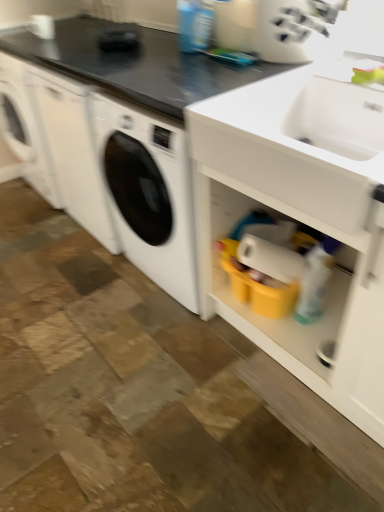
Question: Considering the relative sizes of white matte cabinet at lower right and black matte countertop at upper center in the image provided, is white matte cabinet at lower right taller than black matte countertop at upper center?

Choices:
 (A) yes
 (B) no

Answer: (A)

Question: Can we say white matte cabinet at lower right lies outside black matte countertop at upper center?

Choices:
 (A) no
 (B) yes

Answer: (B)

Question: Is white matte cabinet at lower right thinner than black matte countertop at upper center?

Choices:
 (A) no
 (B) yes

Answer: (A)

Question: Are white matte cabinet at lower right and black matte countertop at upper center beside each other?

Choices:
 (A) no
 (B) yes

Answer: (A)

Question: From a real-world perspective, is white matte cabinet at lower right physically below black matte countertop at upper center?

Choices:
 (A) yes
 (B) no

Answer: (A)

Question: Considering the positions of white plastic knife block at upper center and black matte countertop at upper center in the image, is white plastic knife block at upper center taller or shorter than black matte countertop at upper center?

Choices:
 (A) tall
 (B) short

Answer: (A)

Question: Is white plastic knife block at upper center bigger or smaller than black matte countertop at upper center?

Choices:
 (A) big
 (B) small

Answer: (B)

Question: Is white plastic knife block at upper center in front of or behind black matte countertop at upper center in the image?

Choices:
 (A) behind
 (B) front

Answer: (A)

Question: From the image's perspective, relative to black matte countertop at upper center, is white plastic knife block at upper center above or below?

Choices:
 (A) above
 (B) below

Answer: (B)

Question: Considering the positions of point (79, 56) and point (264, 23), is point (79, 56) closer or farther from the camera than point (264, 23)?

Choices:
 (A) closer
 (B) farther

Answer: (B)

Question: Looking at their shapes, would you say black matte countertop at upper center is wider or thinner than white plastic knife block at upper center?

Choices:
 (A) thin
 (B) wide

Answer: (B)

Question: From a real-world perspective, relative to white plastic knife block at upper center, is black matte countertop at upper center vertically above or below?

Choices:
 (A) below
 (B) above

Answer: (A)

Question: Which is correct: black matte countertop at upper center is inside white plastic knife block at upper center, or outside of it?

Choices:
 (A) outside
 (B) inside

Answer: (A)

Question: Visually, is white matte cabinet at lower right positioned to the left or to the right of black matte countertop at upper center?

Choices:
 (A) left
 (B) right

Answer: (B)

Question: Is point (319, 161) positioned closer to the camera than point (140, 75)?

Choices:
 (A) closer
 (B) farther

Answer: (A)